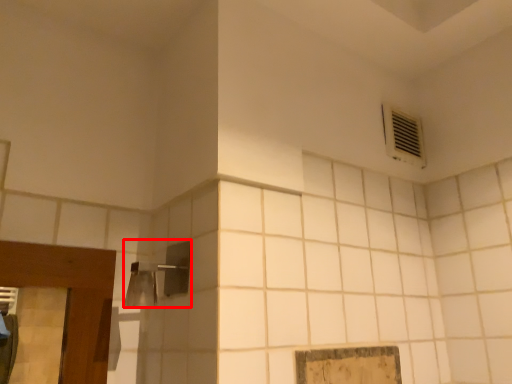
Question: From the image's perspective, where is shower (annotated by the red box) located relative to air conditioning?

Choices:
 (A) below
 (B) above

Answer: (A)